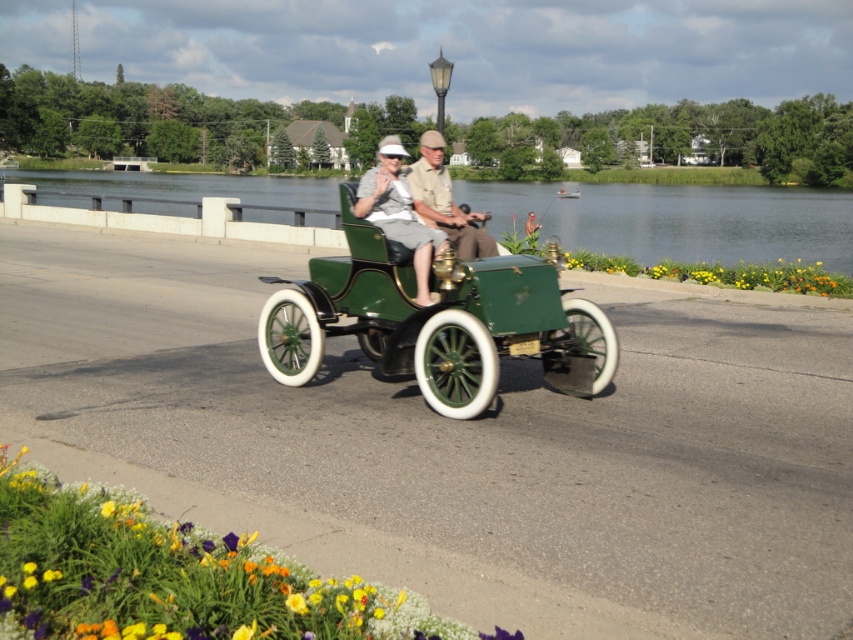
You are a photographer planning to take a picture of the matte green car at center and the green matte vintage car at center from a position behind the grassy area. Which car will appear taller in the photo?

The matte green car at center will appear taller in the photo because it is much taller than the green matte vintage car at center according to the description.

You are a passenger in the green matte sidecar at center and the matte green car at center. Which one has more space for your luggage?

The green matte sidecar at center is larger in size than the matte green car at center, so it has more space for your luggage.

You are a passenger in the green matte sidecar at center and want to reach the yellow matte flower at right. Can you easily stretch your hand out of the sidecar to touch the flower?

The green matte sidecar at center is positioned under the yellow matte flower at right, so the flower is directly above the sidecar. Since the flower is above, you would need to reach upwards rather than stretching forward or sideways to touch it.